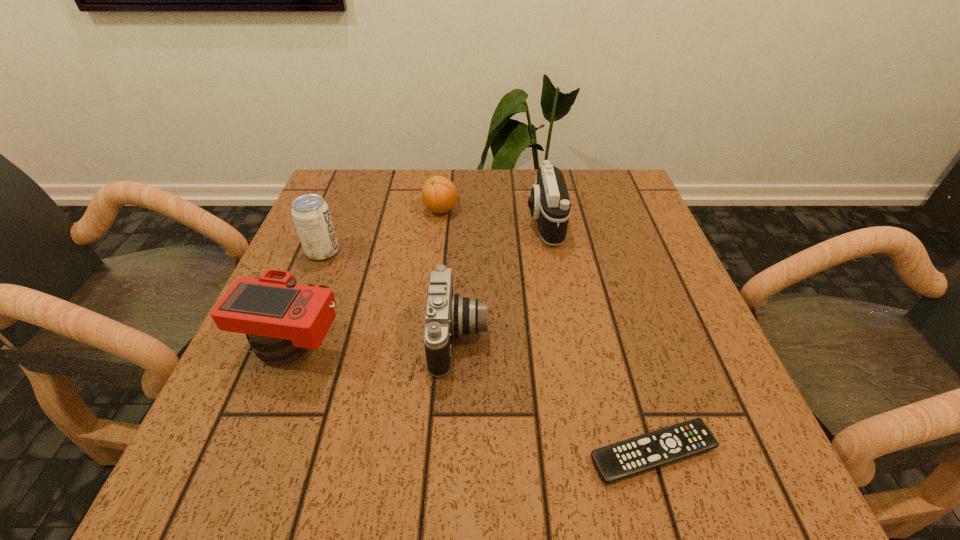
Locate an element on the screen. vacant space situated on the front of the soda can is located at coordinates (272, 377).

In order to click on vacant area situated on the right of the leftmost camera in this screenshot , I will do `click(555, 345)`.

Where is `vacant space located 0.350m on the front-facing side of the second camera from left to right`? Image resolution: width=960 pixels, height=540 pixels. vacant space located 0.350m on the front-facing side of the second camera from left to right is located at coordinates (674, 336).

Identify the location of free space located 0.190m on the left of the second shortest object. The width and height of the screenshot is (960, 540). (348, 210).

Where is `vacant point located on the back of the remote control`? This screenshot has width=960, height=540. vacant point located on the back of the remote control is located at coordinates (633, 384).

I want to click on camera positioned at the far edge, so click(x=549, y=202).

Find the location of a particular element. This screenshot has height=540, width=960. orange at the far edge is located at coordinates (439, 194).

The image size is (960, 540). What are the coordinates of `object positioned at the near edge` in the screenshot? It's located at (623, 459).

Identify the location of soda can situated at the left edge. The width and height of the screenshot is (960, 540). (311, 215).

You are a GUI agent. You are given a task and a screenshot of the screen. Output one action in this format:
    pyautogui.click(x=<x>, y=<y>)
    Task: Click on the camera at the left edge
    The height and width of the screenshot is (540, 960).
    Given the screenshot: What is the action you would take?
    pyautogui.click(x=283, y=319)